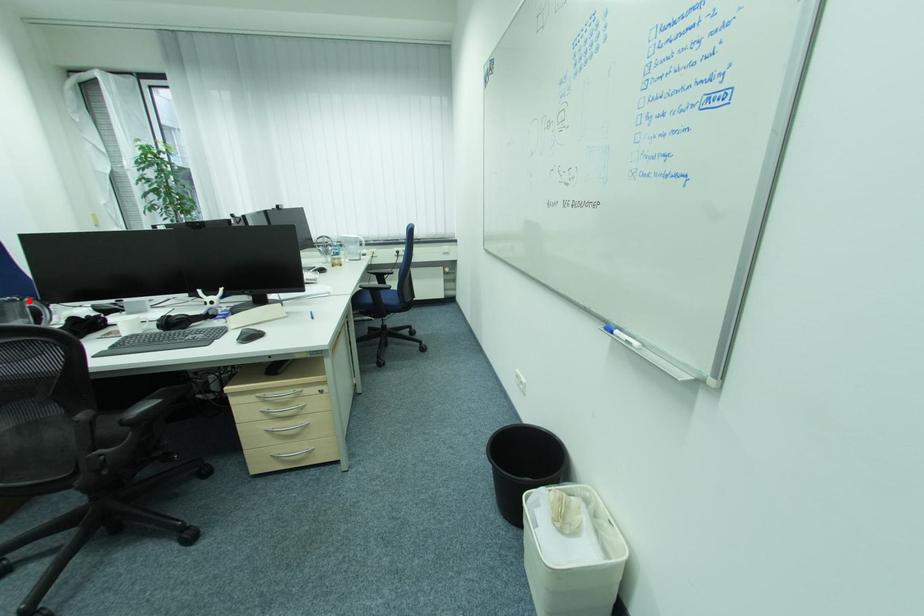
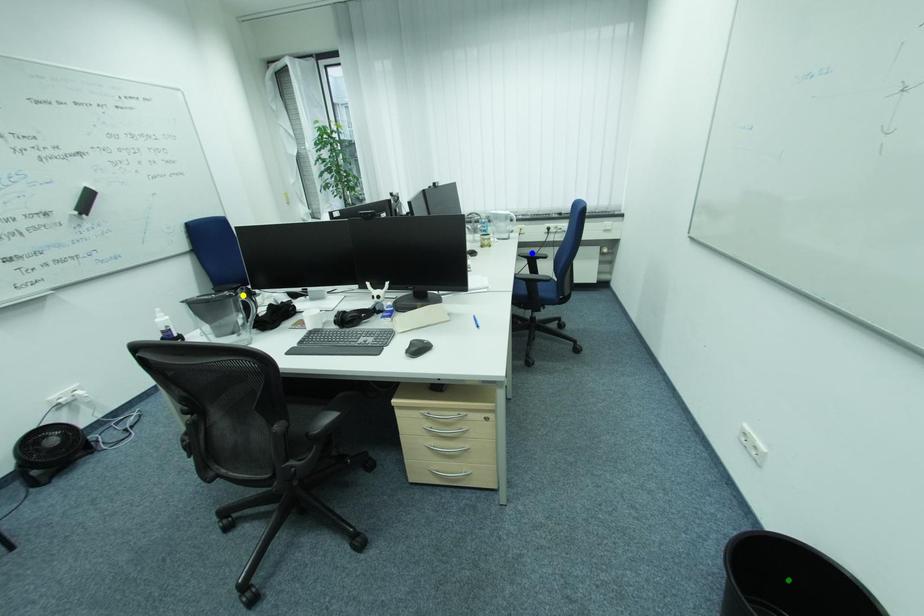
Question: I am providing you with two images of the same scene from different viewpoints. A red point is marked on the first image. You are given multiple points on the second image. Which spot in image 2 lines up with the point in image 1?

Choices:
 (A) green point
 (B) blue point
 (C) yellow point

Answer: (C)